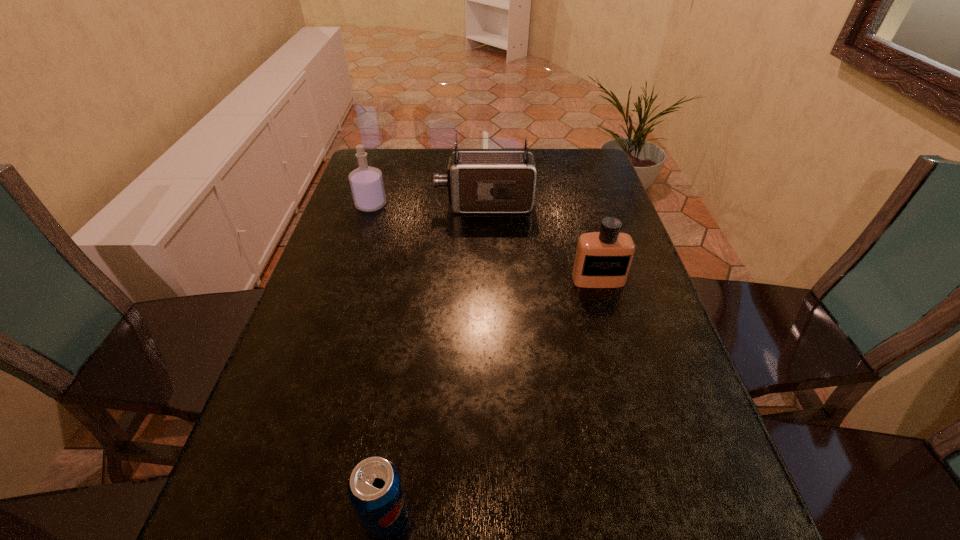
In order to click on camcorder in this screenshot , I will do `click(478, 181)`.

You are a GUI agent. You are given a task and a screenshot of the screen. Output one action in this format:
    pyautogui.click(x=<x>, y=<y>)
    Task: Click on the left perfume
    This screenshot has width=960, height=540.
    Given the screenshot: What is the action you would take?
    pyautogui.click(x=366, y=182)

Where is `the farther perfume`? The image size is (960, 540). the farther perfume is located at coordinates (366, 182).

What are the coordinates of `the nearer perfume` in the screenshot? It's located at (603, 259).

Identify the location of the rightmost object. The height and width of the screenshot is (540, 960). (603, 259).

At what (x,y) coordinates should I click in order to perform the action: click on free point located at the lens of the camcorder. Please return your answer as a coordinate pair (x, y). The image size is (960, 540). Looking at the image, I should click on (384, 205).

You are a GUI agent. You are given a task and a screenshot of the screen. Output one action in this format:
    pyautogui.click(x=<x>, y=<y>)
    Task: Click on the vacant space situated 0.230m at the lens of the camcorder
    
    Given the screenshot: What is the action you would take?
    pyautogui.click(x=361, y=205)

Find the location of a particular element. vacant space located at the lens of the camcorder is located at coordinates (354, 205).

Locate an element on the screen. free location located on the front of the farther perfume is located at coordinates (343, 293).

Identify the location of blank area located on the front label of the right perfume. This screenshot has height=540, width=960. (617, 348).